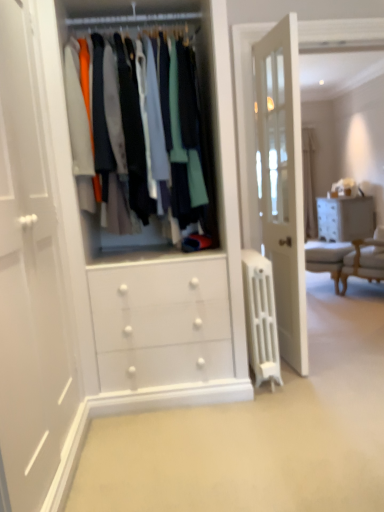
Question: Can you confirm if white textured chest of drawers at right is shorter than light beige fabric armchair at right?

Choices:
 (A) yes
 (B) no

Answer: (A)

Question: Is white textured chest of drawers at right wider than light beige fabric armchair at right?

Choices:
 (A) no
 (B) yes

Answer: (B)

Question: Considering the relative sizes of white textured chest of drawers at right and light beige fabric armchair at right in the image provided, is white textured chest of drawers at right thinner than light beige fabric armchair at right?

Choices:
 (A) yes
 (B) no

Answer: (B)

Question: Would you say light beige fabric armchair at right is part of white textured chest of drawers at right's contents?

Choices:
 (A) no
 (B) yes

Answer: (A)

Question: From a real-world perspective, is white textured chest of drawers at right located higher than light beige fabric armchair at right?

Choices:
 (A) yes
 (B) no

Answer: (B)

Question: Is point (375, 243) closer or farther from the camera than point (326, 203)?

Choices:
 (A) closer
 (B) farther

Answer: (A)

Question: In the image, is light beige fabric armchair at right positioned in front of or behind white textured chest of drawers at right?

Choices:
 (A) behind
 (B) front

Answer: (B)

Question: Is light beige fabric armchair at right inside or outside of white textured chest of drawers at right?

Choices:
 (A) inside
 (B) outside

Answer: (B)

Question: Based on their positions, is light beige fabric armchair at right located to the left or right of white textured chest of drawers at right?

Choices:
 (A) right
 (B) left

Answer: (B)

Question: Relative to light beige fabric armchair at right, is matte white clothes at center in front or behind?

Choices:
 (A) behind
 (B) front

Answer: (B)

Question: Considering the positions of matte white clothes at center and light beige fabric armchair at right in the image, is matte white clothes at center bigger or smaller than light beige fabric armchair at right?

Choices:
 (A) small
 (B) big

Answer: (B)

Question: Do you think matte white clothes at center is within light beige fabric armchair at right, or outside of it?

Choices:
 (A) inside
 (B) outside

Answer: (B)

Question: Is point coord(203,217) closer or farther from the camera than point coord(375,240)?

Choices:
 (A) closer
 (B) farther

Answer: (A)

Question: Do you think white painted radiator at center is within white textured chest of drawers at right, or outside of it?

Choices:
 (A) inside
 (B) outside

Answer: (B)

Question: Is point (256, 340) closer or farther from the camera than point (362, 231)?

Choices:
 (A) closer
 (B) farther

Answer: (A)